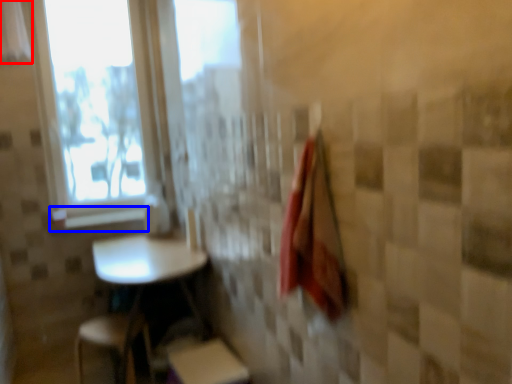
Question: Which object is further to the camera taking this photo, curtain (highlighted by a red box) or window sill (highlighted by a blue box)?

Choices:
 (A) curtain
 (B) window sill

Answer: (B)